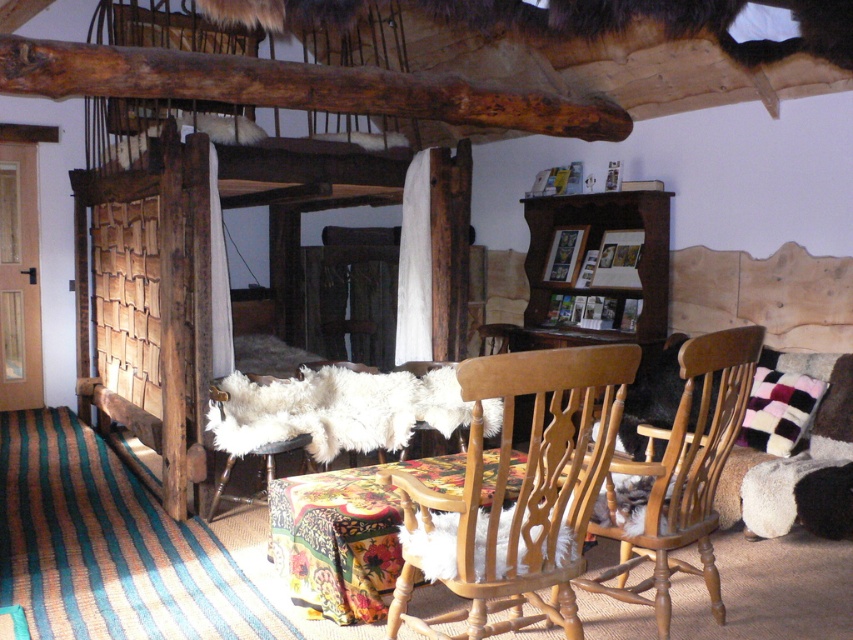
You are standing in the room and want to know how far you are from the point marked at coordinates point (531,387). Can you determine the distance?

The distance between you and the point marked at coordinates point (531,387) is 7.31 feet.